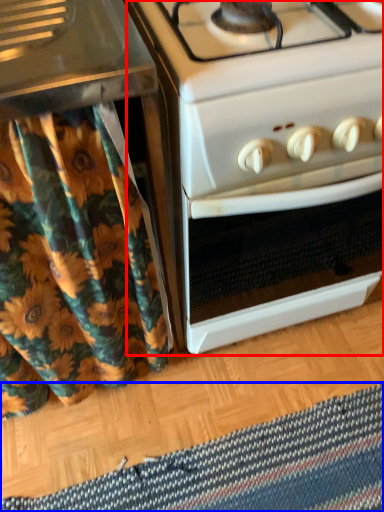
Question: Among these objects, which one is farthest to the camera, oven (highlighted by a red box) or mat (highlighted by a blue box)?

Choices:
 (A) oven
 (B) mat

Answer: (B)